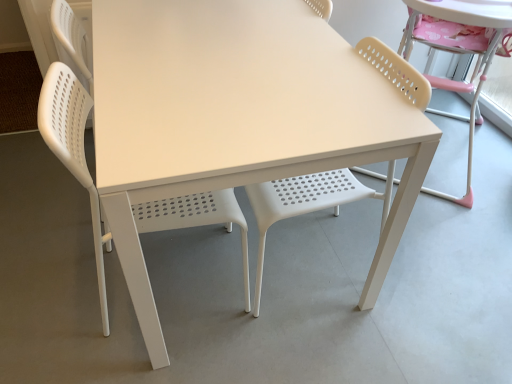
Question: Is white plastic chair at left, arranged as the 3th chair when viewed from the right, taller than beige perforated chair at right, placed as the 3th chair when sorted from left to right?

Choices:
 (A) no
 (B) yes

Answer: (A)

Question: From the image's perspective, would you say white plastic chair at left, arranged as the 3th chair when viewed from the right, is positioned over beige perforated chair at right, the first chair viewed from the right?

Choices:
 (A) yes
 (B) no

Answer: (B)

Question: Is white plastic chair at left, which ranks as the 1th chair in left-to-right order, aimed at beige perforated chair at right, placed as the 3th chair when sorted from left to right?

Choices:
 (A) yes
 (B) no

Answer: (B)

Question: From a real-world perspective, does white plastic chair at left, which ranks as the 1th chair in left-to-right order, stand above beige perforated chair at right, placed as the 3th chair when sorted from left to right?

Choices:
 (A) no
 (B) yes

Answer: (A)

Question: Is white plastic chair at left, which ranks as the 1th chair in left-to-right order, completely or partially outside of beige perforated chair at right, the first chair viewed from the right?

Choices:
 (A) no
 (B) yes

Answer: (B)

Question: In the image, is white plastic chair at left, arranged as the 3th chair when viewed from the right, positioned in front of or behind matte white chair at center, placed as the second chair when sorted from right to left?

Choices:
 (A) front
 (B) behind

Answer: (A)

Question: From a real-world perspective, is white plastic chair at left, arranged as the 3th chair when viewed from the right, positioned above or below matte white chair at center, placed as the second chair when sorted from right to left?

Choices:
 (A) above
 (B) below

Answer: (B)

Question: Do you think white plastic chair at left, arranged as the 3th chair when viewed from the right, is within matte white chair at center, which ranks as the 2th chair in left-to-right order, or outside of it?

Choices:
 (A) inside
 (B) outside

Answer: (B)

Question: In terms of height, does white plastic chair at left, which ranks as the 1th chair in left-to-right order, look taller or shorter compared to matte white chair at center, placed as the second chair when sorted from right to left?

Choices:
 (A) tall
 (B) short

Answer: (A)

Question: Looking at their shapes, would you say beige perforated chair at right, placed as the 3th chair when sorted from left to right, is wider or thinner than white plastic table at center?

Choices:
 (A) thin
 (B) wide

Answer: (A)

Question: From the image's perspective, is beige perforated chair at right, the first chair viewed from the right, positioned above or below white plastic table at center?

Choices:
 (A) above
 (B) below

Answer: (A)

Question: Is beige perforated chair at right, the first chair viewed from the right, bigger or smaller than white plastic table at center?

Choices:
 (A) big
 (B) small

Answer: (A)

Question: In the image, is beige perforated chair at right, the first chair viewed from the right, on the left side or the right side of white plastic table at center?

Choices:
 (A) right
 (B) left

Answer: (A)

Question: Is matte white chair at center, placed as the second chair when sorted from right to left, bigger or smaller than white plastic chair at left, arranged as the 3th chair when viewed from the right?

Choices:
 (A) big
 (B) small

Answer: (B)

Question: Would you say matte white chair at center, which ranks as the 2th chair in left-to-right order, is to the left or to the right of white plastic chair at left, which ranks as the 1th chair in left-to-right order, in the picture?

Choices:
 (A) right
 (B) left

Answer: (A)